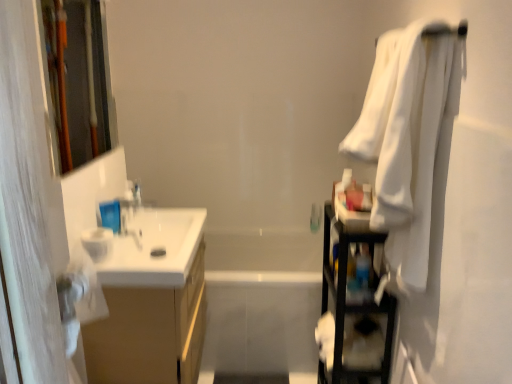
Question: From the image's perspective, is clear plastic bottle at upper left located above white glossy bathtub at center?

Choices:
 (A) no
 (B) yes

Answer: (B)

Question: Is clear plastic bottle at upper left outside of white glossy bathtub at center?

Choices:
 (A) no
 (B) yes

Answer: (B)

Question: Considering the relative sizes of clear plastic bottle at upper left and white glossy bathtub at center in the image provided, is clear plastic bottle at upper left shorter than white glossy bathtub at center?

Choices:
 (A) no
 (B) yes

Answer: (B)

Question: Is clear plastic bottle at upper left wider than white glossy bathtub at center?

Choices:
 (A) yes
 (B) no

Answer: (B)

Question: Is clear plastic bottle at upper left looking in the opposite direction of white glossy bathtub at center?

Choices:
 (A) yes
 (B) no

Answer: (B)

Question: Can you confirm if clear plastic bottle at upper left is bigger than white glossy bathtub at center?

Choices:
 (A) yes
 (B) no

Answer: (B)

Question: Is clear plastic bottle at upper left positioned far away from white glossy sink at left?

Choices:
 (A) yes
 (B) no

Answer: (B)

Question: Can you confirm if clear plastic bottle at upper left is wider than white glossy sink at left?

Choices:
 (A) yes
 (B) no

Answer: (B)

Question: Can you confirm if clear plastic bottle at upper left is bigger than white glossy sink at left?

Choices:
 (A) yes
 (B) no

Answer: (B)

Question: Does clear plastic bottle at upper left have a lesser width compared to white glossy sink at left?

Choices:
 (A) yes
 (B) no

Answer: (A)

Question: Is clear plastic bottle at upper left at the right side of white glossy sink at left?

Choices:
 (A) no
 (B) yes

Answer: (A)

Question: Can you confirm if clear plastic bottle at upper left is shorter than white glossy sink at left?

Choices:
 (A) yes
 (B) no

Answer: (B)

Question: Is wooden frame at left looking in the opposite direction of white glossy bathtub at center?

Choices:
 (A) yes
 (B) no

Answer: (B)